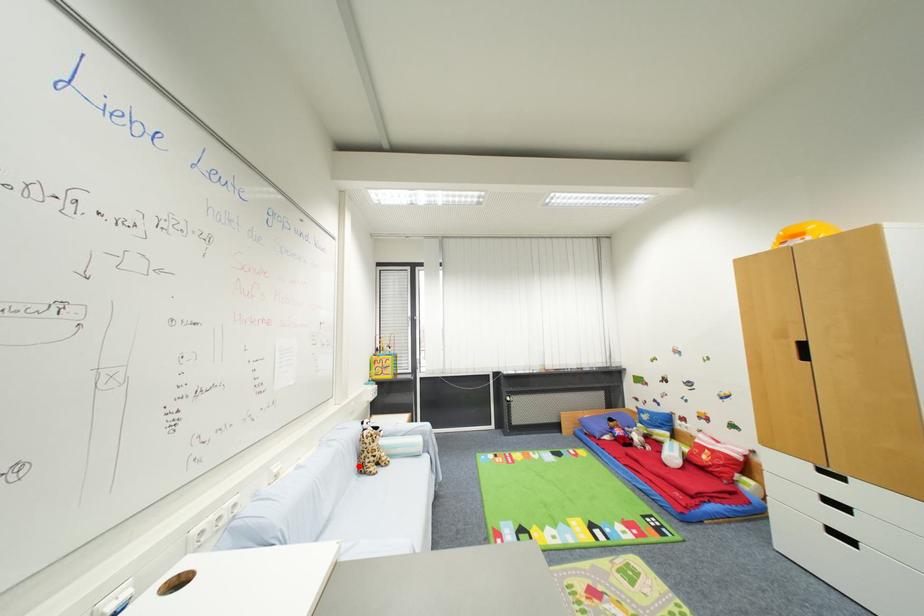
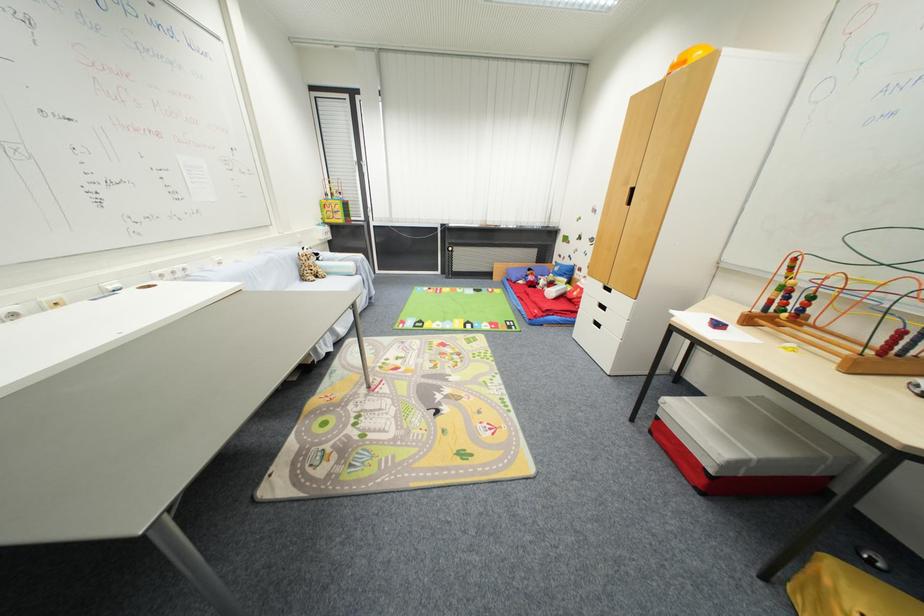
The point at the highlighted location is marked in the first image. Where is the corresponding point in the second image?

(300, 276)